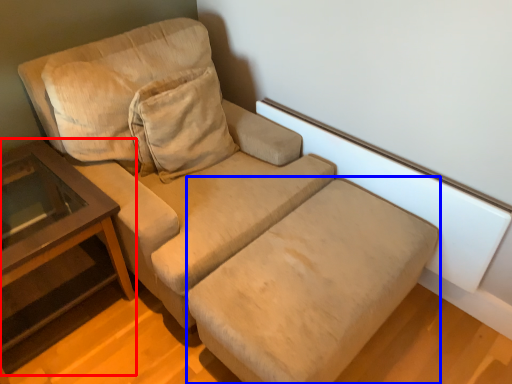
Question: Among these objects, which one is nearest to the camera, table (highlighted by a red box) or footrest (highlighted by a blue box)?

Choices:
 (A) table
 (B) footrest

Answer: (B)